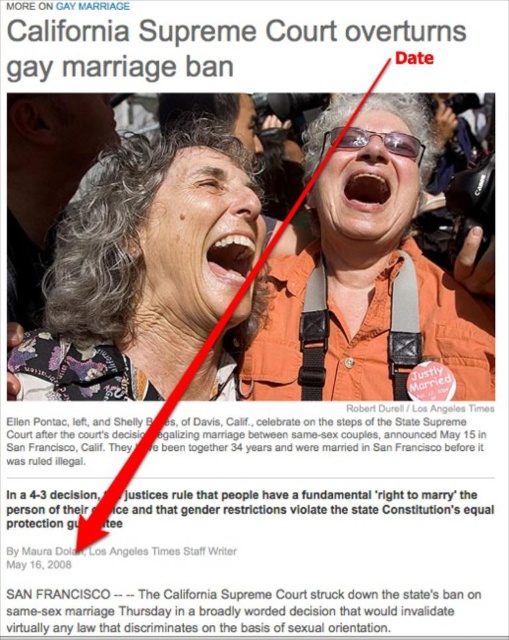
You are a photographer reviewing the image of the two women celebrating on the courthouse steps. You need to determine which object is smaller between the matte orange shirt at upper right and the matte black goggles at center. Which one is smaller?

The matte orange shirt at upper right is smaller than the matte black goggles at center.

Looking at this image, you are a photographer standing in front of the courthouse where the photo was taken. You want to take a new photo that includes both the matte orange shirt at upper right and the matte black goggles at center. Given the distance between them, will your camera with a 50mm lens be able to capture both subjects in the frame?

The distance between the matte orange shirt at upper right and the matte black goggles at center is 8.79 feet. With a 50mm lens, the camera can typically capture subjects within a reasonable distance, so yes, both subjects can be included in the frame.

Based on the photo, based on the provided image description, what object or feature is located at the coordinates point (143, 268)?

The point (143, 268) corresponds to gray textured hair at upper left.